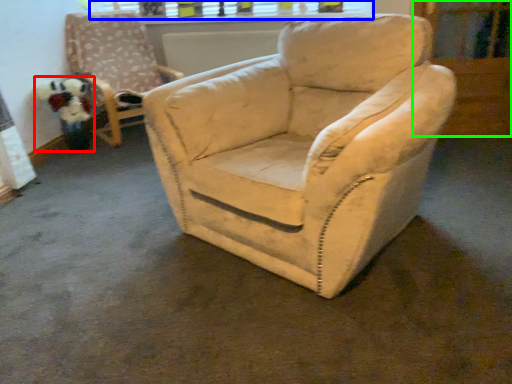
Question: Which is farther away from toy (highlighted by a red box)? window frame (highlighted by a blue box) or screen door (highlighted by a green box)?

Choices:
 (A) window frame
 (B) screen door

Answer: (B)